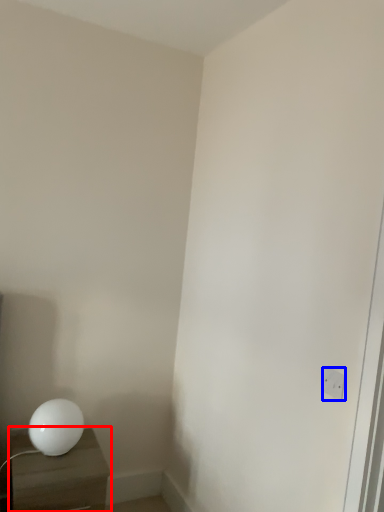
Question: Which object appears farthest to the camera in this image, nightstand (highlighted by a red box) or electric outlet (highlighted by a blue box)?

Choices:
 (A) nightstand
 (B) electric outlet

Answer: (A)